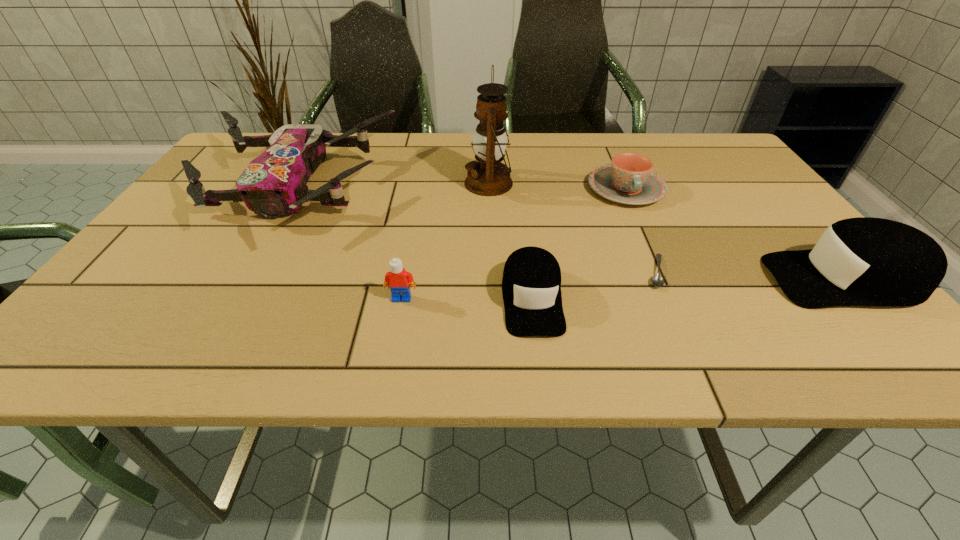
Observe the arrangement of all caps in the image. To keep them evenly spaced, where would you place another cap on the left? Please locate a free space. Please provide its 2D coordinates. Your answer should be formatted as a tuple, i.e. [(x, y)], where the tuple contains the x and y coordinates of a point satisfying the conditions above.

[(189, 320)]